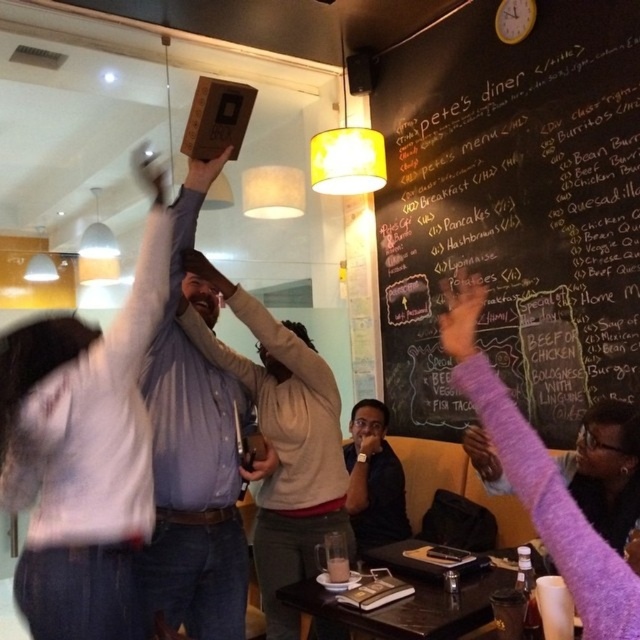
Question: Does purple fuzzy arm at upper right have a smaller size compared to black matte shirt at center?

Choices:
 (A) yes
 (B) no

Answer: (A)

Question: Does black chalkboard menu at upper right have a greater width compared to black matte shirt at center?

Choices:
 (A) yes
 (B) no

Answer: (A)

Question: Which object appears closest to the camera in this image?

Choices:
 (A) purple fuzzy arm at upper right
 (B) black matte shirt at center
 (C) purple fuzzy hand at upper center
 (D) matte blue shirt at center

Answer: (A)

Question: Which point is farther to the camera?

Choices:
 (A) purple fuzzy hand at upper center
 (B) black matte shirt at center
 (C) matte blue shirt at center
 (D) purple fuzzy arm at upper right

Answer: (A)

Question: Where is purple fuzzy arm at upper right located in relation to black matte shirt at center in the image?

Choices:
 (A) below
 (B) above

Answer: (B)

Question: Which point is closer to the camera taking this photo?

Choices:
 (A) (468, 324)
 (B) (401, 508)

Answer: (A)